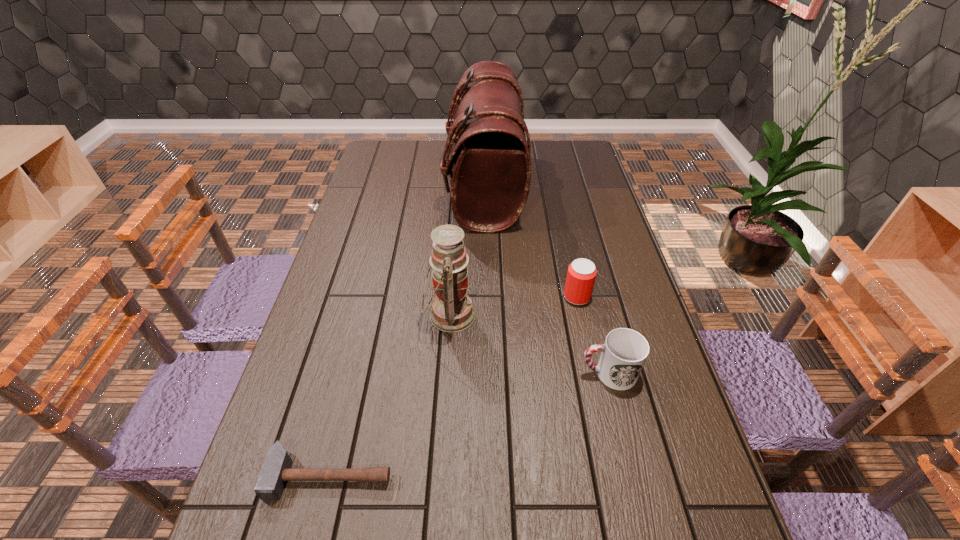
In order to click on vacant area that satisfies the following two spatial constraints: 1. on the front-facing side of the farthest object; 2. on the handle side of the cup in this screenshot , I will do `click(487, 373)`.